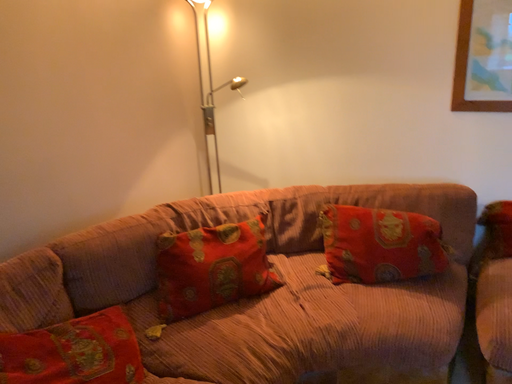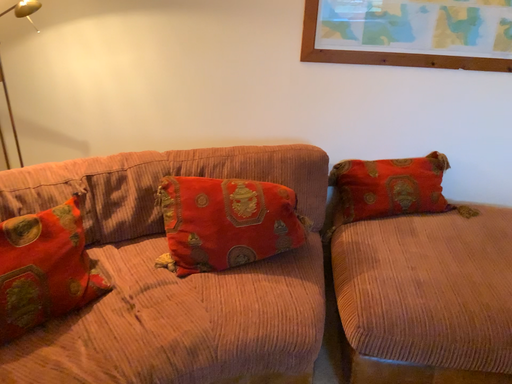
Question: Which way did the camera rotate in the video?

Choices:
 (A) rotated downward
 (B) rotated upward

Answer: (A)